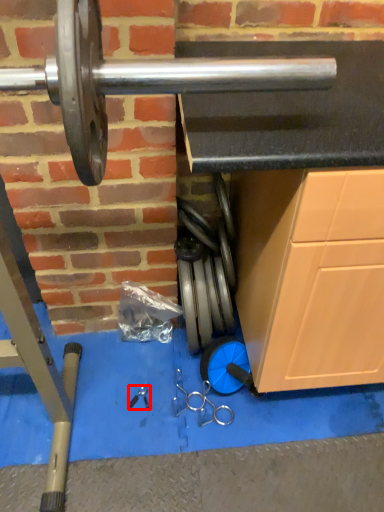
Question: Observing the image, what is the correct spatial positioning of tool (annotated by the red box) in reference to tool?

Choices:
 (A) right
 (B) left

Answer: (B)